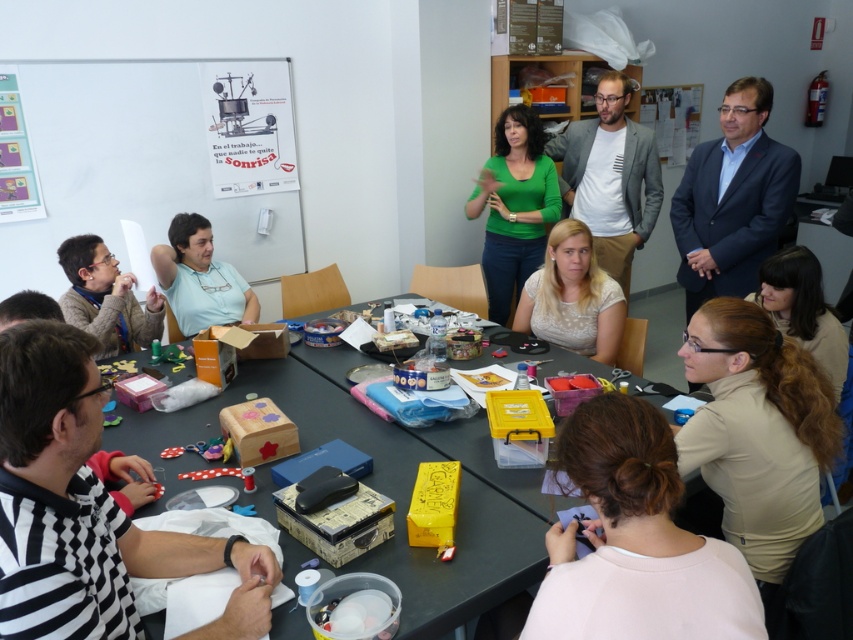
Find the location of `pink fabric at lower center`. pink fabric at lower center is located at coordinates (636, 541).

Which is behind, point (3, 259) or point (334, 376)?

The point (3, 259) is more distant.

Does point (294, 220) come in front of point (521, 488)?

That is False.

Where is `white paperboard at upper left`? The height and width of the screenshot is (640, 853). white paperboard at upper left is located at coordinates (138, 168).

The image size is (853, 640). Identify the location of white paperboard at upper left. (138, 168).

Can you confirm if pink fabric at lower center is taller than green matte shirt at center?

No.

Is pink fabric at lower center thinner than green matte shirt at center?

Correct, pink fabric at lower center's width is less than green matte shirt at center's.

Who is more distant from viewer, (718,540) or (550,196)?

Positioned behind is point (550,196).

Where is `pink fabric at lower center`? pink fabric at lower center is located at coordinates (636, 541).